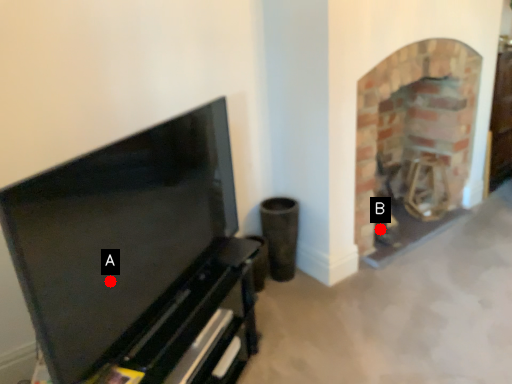
Question: Two points are circled on the image, labeled by A and B beside each circle. Among these points, which one is farthest from the camera?

Choices:
 (A) A is further
 (B) B is further

Answer: (B)